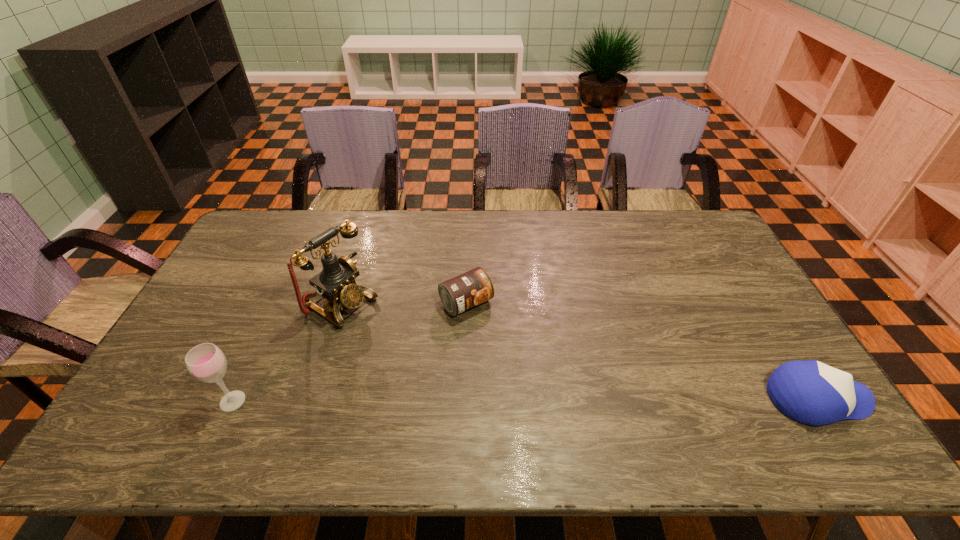
Find the location of a particular element. The width and height of the screenshot is (960, 540). the second tallest object is located at coordinates (206, 362).

I want to click on the leftmost object, so click(206, 362).

Image resolution: width=960 pixels, height=540 pixels. I want to click on baseball cap, so click(810, 392).

Image resolution: width=960 pixels, height=540 pixels. Find the location of `can`. can is located at coordinates click(465, 291).

The image size is (960, 540). I want to click on telephone, so click(336, 282).

The image size is (960, 540). What are the coordinates of `the tallest object` in the screenshot? It's located at (336, 282).

Find the location of a particular element. Image resolution: width=960 pixels, height=540 pixels. vacant space located 0.160m on the back of the third shortest object is located at coordinates (261, 339).

The image size is (960, 540). I want to click on free point located on the front label of the can, so click(x=540, y=388).

Find the location of a particular element. free space located on the front label of the can is located at coordinates (516, 359).

At what (x,y) coordinates should I click in order to perform the action: click on vacant space situated 0.080m on the front label of the can. Please return your answer as a coordinate pair (x, y). The width and height of the screenshot is (960, 540). Looking at the image, I should click on (496, 338).